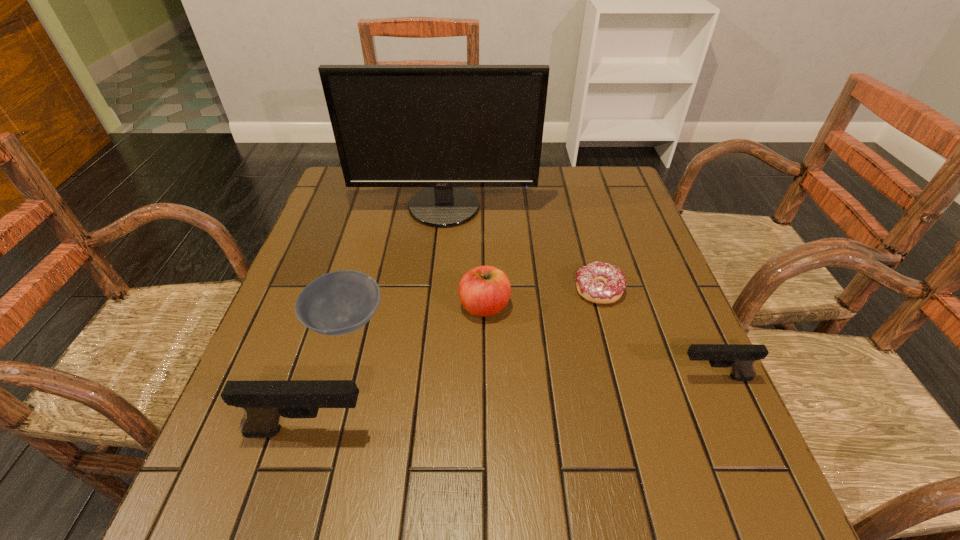
Locate an element on the screen. Image resolution: width=960 pixels, height=540 pixels. pistol that is positioned at the left edge is located at coordinates (264, 402).

I want to click on monitor that is at the left edge, so click(x=445, y=127).

I want to click on bowl that is at the left edge, so click(337, 303).

In order to click on pistol present at the right edge in this screenshot , I will do `click(740, 357)`.

You are a GUI agent. You are given a task and a screenshot of the screen. Output one action in this format:
    pyautogui.click(x=<x>, y=<y>)
    Task: Click on the doughnut at the right edge
    
    Given the screenshot: What is the action you would take?
    pyautogui.click(x=589, y=278)

Identify the location of object at the far left corner. This screenshot has height=540, width=960. (445, 127).

The height and width of the screenshot is (540, 960). I want to click on object present at the near left corner, so click(264, 402).

Where is `vacant position at the far edge of the desktop`? This screenshot has height=540, width=960. vacant position at the far edge of the desktop is located at coordinates (481, 191).

Identify the location of vacant position at the near edge of the desktop. (572, 434).

Find the location of `vacant space at the left edge of the desktop`. vacant space at the left edge of the desktop is located at coordinates (373, 218).